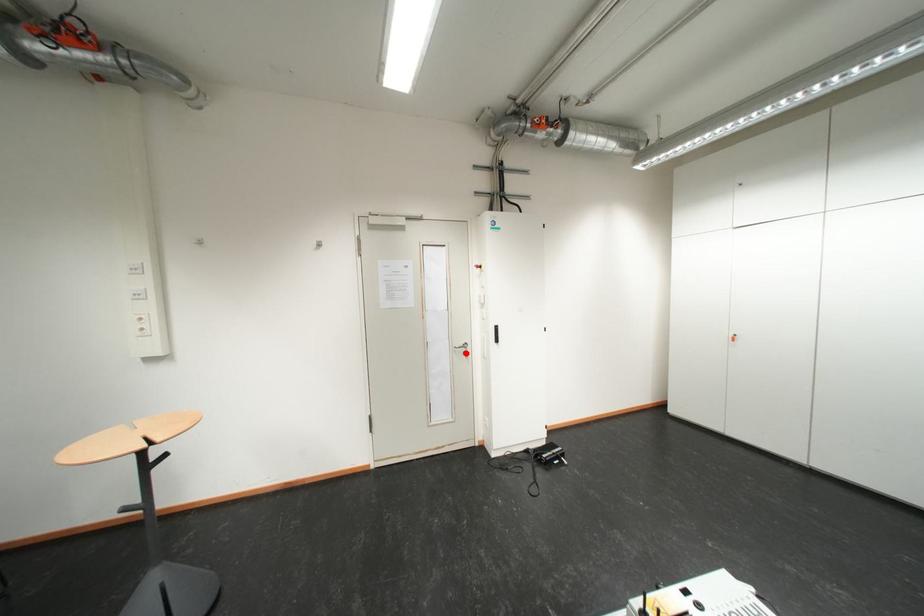
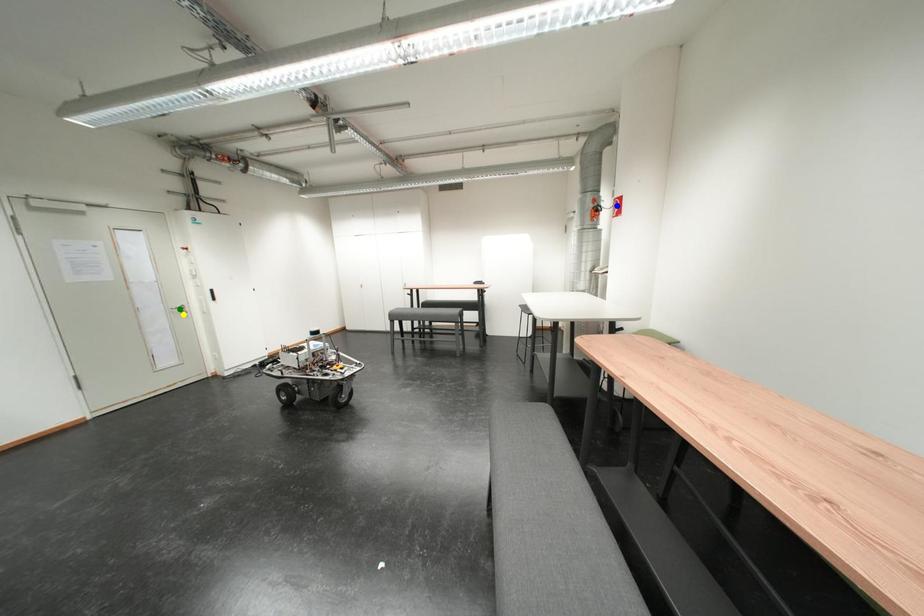
Question: I am providing you with two images of the same scene from different viewpoints. A red point is marked on the first image. You are given multiple points on the second image. Which point in image 2 represents the same 3d spot as the red point in image 1?

Choices:
 (A) yellow point
 (B) blue point
 (C) green point

Answer: (A)